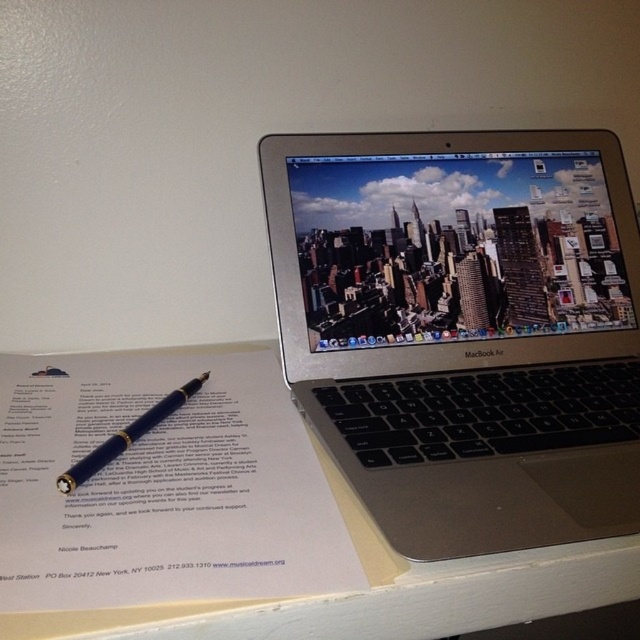
You are organizing your desk and need to place both the silver metallic laptop at upper right and the blue polished pen at lower left into a drawer. The drawer has a width of 10 inches. If the laptop is wider than the pen, will both items fit side by side in the drawer?

The silver metallic laptop at upper right is wider than the blue polished pen at lower left. Since the drawer is 10 inches wide, the combined width of both items must be less than or equal to 10 inches. However, without knowing the exact widths of each item, it is impossible to determine if they will fit side by side.

You are looking at the MacBook Air laptop on the white surface. There are two points marked in the image. The first point is at coordinates point [536,189] and the second is at point [170,412]. Which point is closer to you?

Point [536,189] is closer to you because it is further to the viewer than point [170,412].